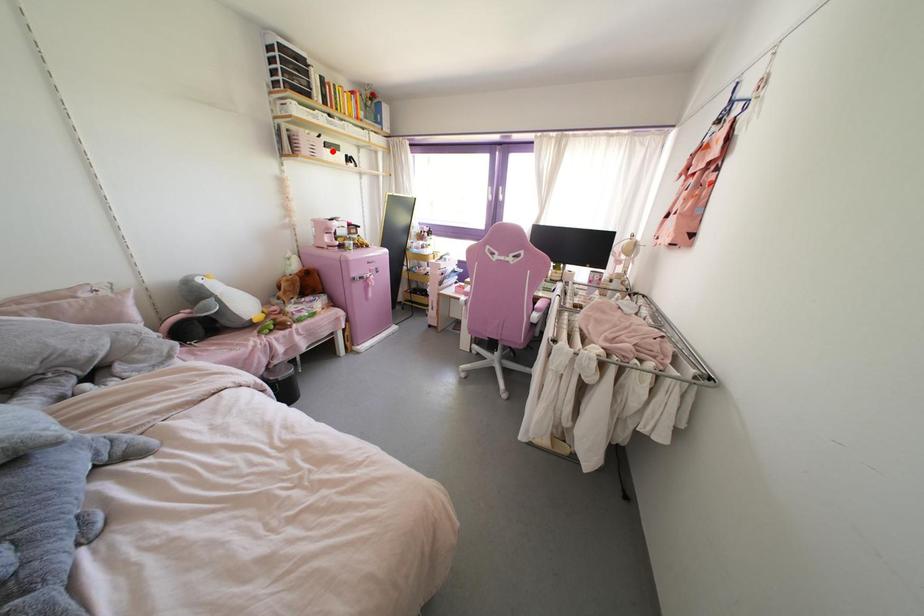
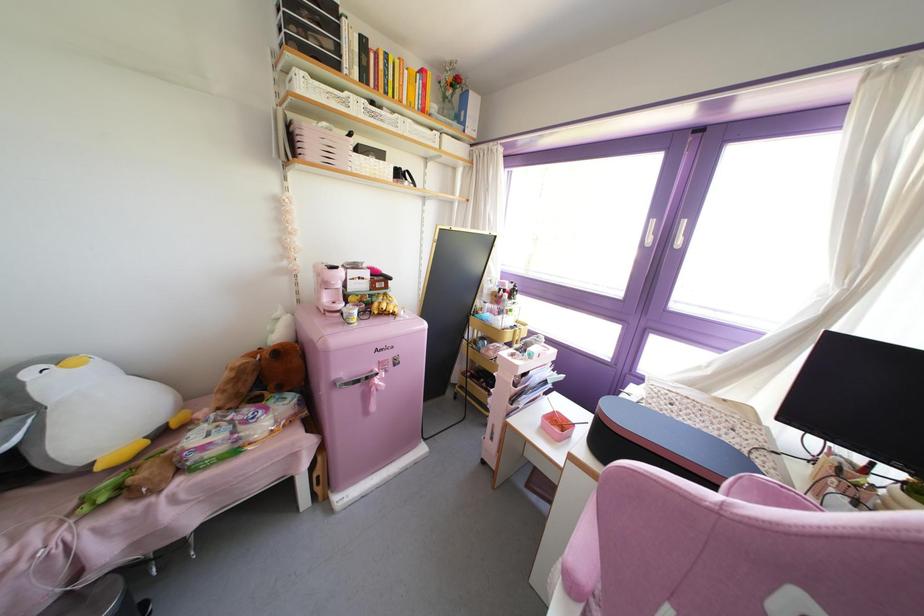
Find the pixel in the second image that matches the highlighted location in the first image.

(371, 160)